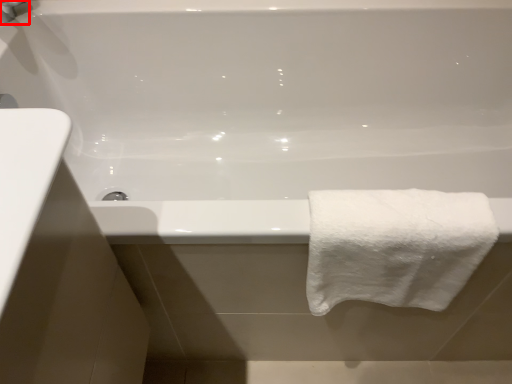
Question: From the image's perspective, where is faucet (annotated by the red box) located in relation to towel in the image?

Choices:
 (A) below
 (B) above

Answer: (B)